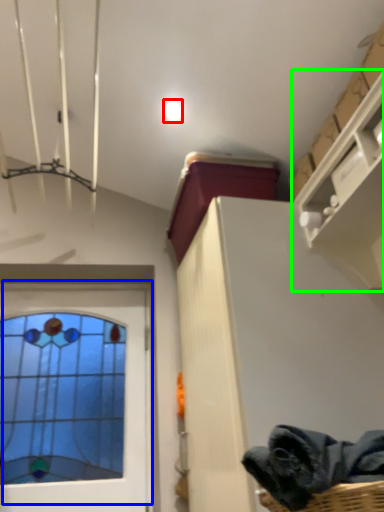
Question: Estimate the real-world distances between objects in this image. Which object is closer to droplight (highlighted by a red box), window (highlighted by a blue box) or shelf (highlighted by a green box)?

Choices:
 (A) window
 (B) shelf

Answer: (B)